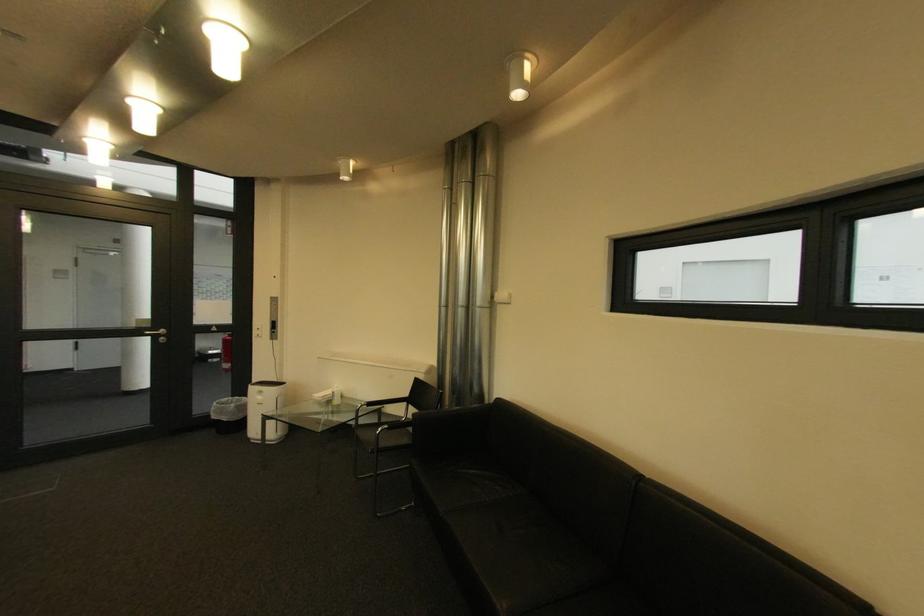
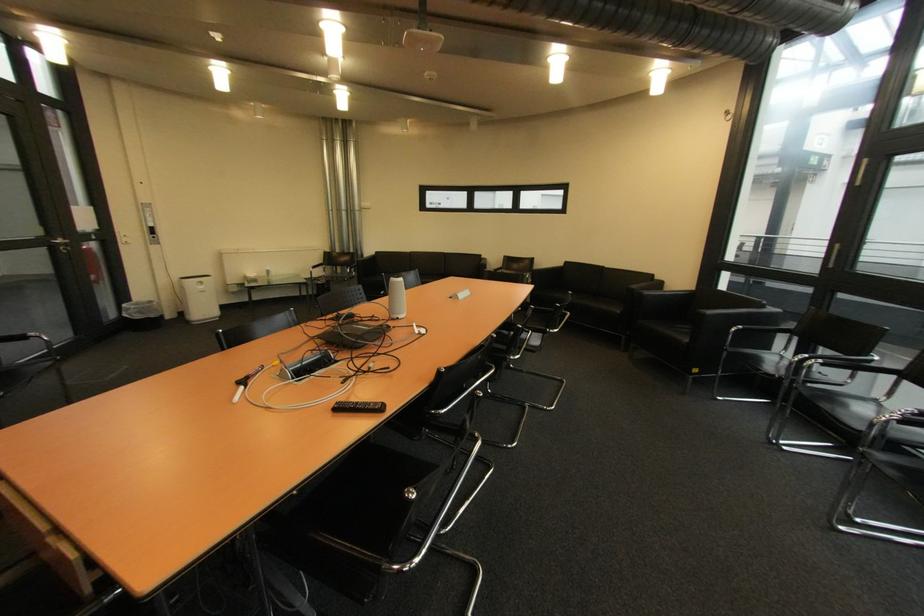
The point at (268, 399) is marked in the first image. Where is the corresponding point in the second image?

(209, 288)